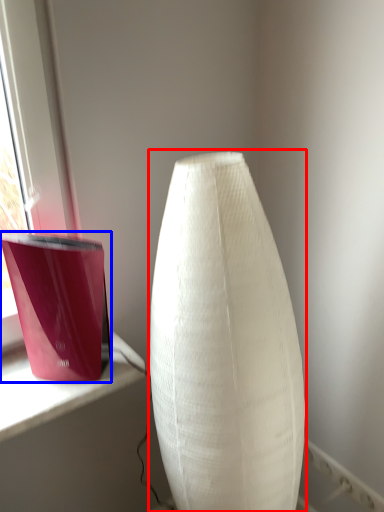
Question: Which object appears farthest to the camera in this image, lamp (highlighted by a red box) or candle holder (highlighted by a blue box)?

Choices:
 (A) lamp
 (B) candle holder

Answer: (B)